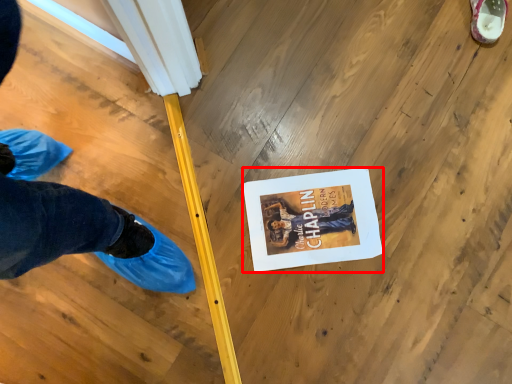
Question: From the image's perspective, where is magazine (annotated by the red box) located relative to footwear?

Choices:
 (A) below
 (B) above

Answer: (A)